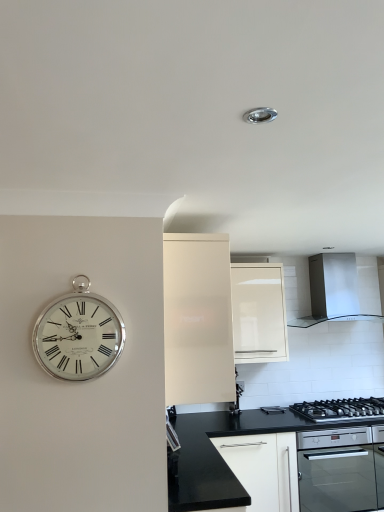
Question: Considering the relative sizes of white glossy cabinet at upper center, the second cabinetry positioned from the left, and black granite countertop at lower center in the image provided, is white glossy cabinet at upper center, the second cabinetry positioned from the left, shorter than black granite countertop at lower center?

Choices:
 (A) no
 (B) yes

Answer: (A)

Question: Does white glossy cabinet at upper center, placed as the 1th cabinetry when sorted from right to left, touch black granite countertop at lower center?

Choices:
 (A) no
 (B) yes

Answer: (A)

Question: Does white glossy cabinet at upper center, the second cabinetry positioned from the left, have a smaller size compared to black granite countertop at lower center?

Choices:
 (A) no
 (B) yes

Answer: (B)

Question: Considering the relative sizes of white glossy cabinet at upper center, the second cabinetry positioned from the left, and black granite countertop at lower center in the image provided, is white glossy cabinet at upper center, the second cabinetry positioned from the left, bigger than black granite countertop at lower center?

Choices:
 (A) no
 (B) yes

Answer: (A)

Question: Is white glossy cabinet at upper center, the second cabinetry positioned from the left, positioned far away from black granite countertop at lower center?

Choices:
 (A) no
 (B) yes

Answer: (A)

Question: Considering the positions of point (96, 360) and point (248, 501), is point (96, 360) closer or farther from the camera than point (248, 501)?

Choices:
 (A) farther
 (B) closer

Answer: (B)

Question: Considering their positions, is silver metallic clock at left located in front of or behind black granite countertop at lower center?

Choices:
 (A) front
 (B) behind

Answer: (A)

Question: Considering the positions of silver metallic clock at left and black granite countertop at lower center in the image, is silver metallic clock at left bigger or smaller than black granite countertop at lower center?

Choices:
 (A) small
 (B) big

Answer: (A)

Question: Visually, is silver metallic clock at left positioned to the left or to the right of black granite countertop at lower center?

Choices:
 (A) right
 (B) left

Answer: (B)

Question: Considering the positions of black granite countertop at lower center and matte white cabinet at center, the second cabinetry positioned from the right, in the image, is black granite countertop at lower center taller or shorter than matte white cabinet at center, the second cabinetry positioned from the right,?

Choices:
 (A) short
 (B) tall

Answer: (A)

Question: From the image's perspective, is black granite countertop at lower center above or below matte white cabinet at center, the second cabinetry positioned from the right?

Choices:
 (A) above
 (B) below

Answer: (B)

Question: Does point (178, 467) appear closer or farther from the camera than point (172, 361)?

Choices:
 (A) farther
 (B) closer

Answer: (A)

Question: Which is correct: black granite countertop at lower center is inside matte white cabinet at center, the first cabinetry positioned from the left, or outside of it?

Choices:
 (A) outside
 (B) inside

Answer: (A)

Question: From the image's perspective, is matte white cabinet at center, the second cabinetry positioned from the right, positioned above or below white glossy cabinet at upper center, placed as the 1th cabinetry when sorted from right to left?

Choices:
 (A) below
 (B) above

Answer: (B)

Question: In the image, is matte white cabinet at center, the second cabinetry positioned from the right, on the left side or the right side of white glossy cabinet at upper center, the second cabinetry positioned from the left?

Choices:
 (A) right
 (B) left

Answer: (B)